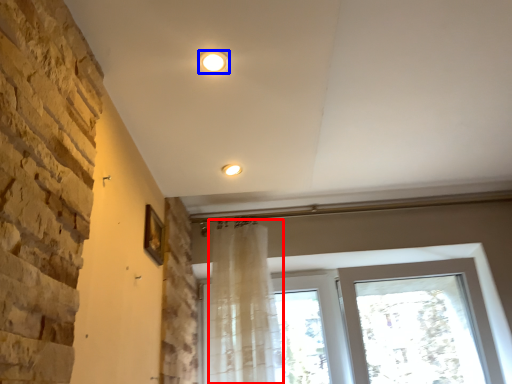
Question: Which object is further to the camera taking this photo, shower curtain (highlighted by a red box) or lighting (highlighted by a blue box)?

Choices:
 (A) shower curtain
 (B) lighting

Answer: (A)